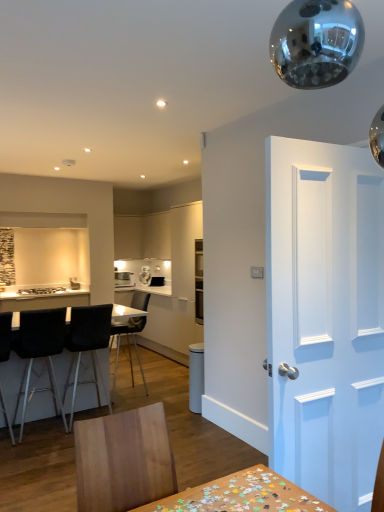
Question: From the image's perspective, is black fabric chair at left, acting as the 3th chair starting from the back, above or below white matte door at right?

Choices:
 (A) above
 (B) below

Answer: (B)

Question: Considering their positions, is black fabric chair at left, the second chair in the front-to-back sequence, located in front of or behind white matte door at right?

Choices:
 (A) front
 (B) behind

Answer: (B)

Question: Which of these objects is positioned farthest from the black leather chair at left, which is the 4th chair from back to front?

Choices:
 (A) matte white cabinet at center, the 2th cabinetry positioned from the right
 (B) black fabric chair at left, the second chair in the front-to-back sequence
 (C) white matte cabinet at center, marked as the second cabinetry in a left-to-right arrangement
 (D) black matte chair at center, which is the 1th chair from back to front
 (E) satin silver toaster at center, which is counted as the first appliance, starting from the left

Answer: (A)

Question: Which object is positioned farthest from the satin silver toaster at center, which is counted as the first appliance, starting from the left?

Choices:
 (A) black fabric chair at left, the second chair in the front-to-back sequence
 (B) white matte door at right
 (C) matte white cabinet at center, the 2th cabinetry positioned from the right
 (D) black leather chair at left, positioned as the 1th chair in front-to-back order
 (E) black matte chair at center, which is the 1th chair from back to front

Answer: (B)